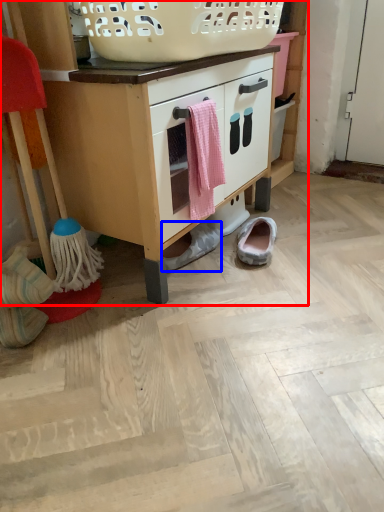
Question: Which point is closer to the camera, cabinetry (highlighted by a red box) or footwear (highlighted by a blue box)?

Choices:
 (A) cabinetry
 (B) footwear

Answer: (A)